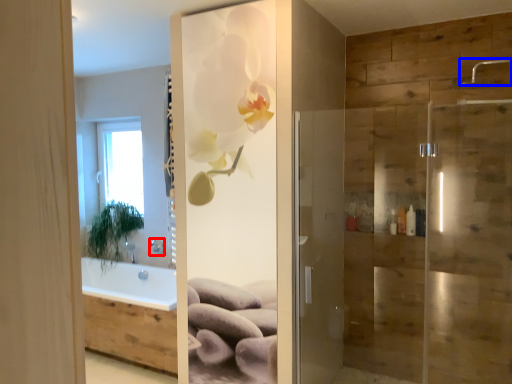
Question: Which object appears closest to the camera in this image, shower (highlighted by a red box) or shower (highlighted by a blue box)?

Choices:
 (A) shower
 (B) shower

Answer: (B)